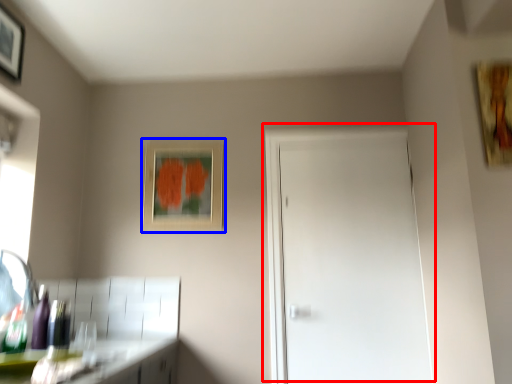
Question: Which of the following is the closest to the observer, door (highlighted by a red box) or picture frame (highlighted by a blue box)?

Choices:
 (A) door
 (B) picture frame

Answer: (A)